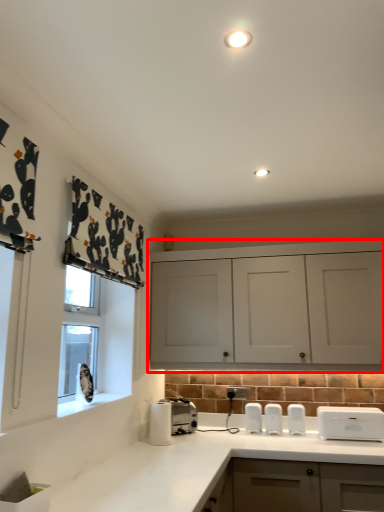
Question: From the image's perspective, considering the relative positions of cabinetry (annotated by the red box) and countertop in the image provided, where is cabinetry (annotated by the red box) located with respect to the staircase?

Choices:
 (A) above
 (B) below

Answer: (A)